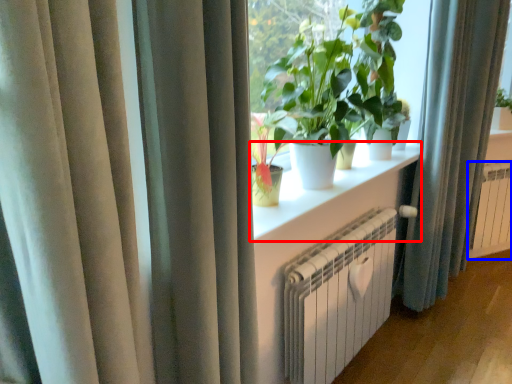
Question: Which object is closer to the camera taking this photo, window sill (highlighted by a red box) or radiator (highlighted by a blue box)?

Choices:
 (A) window sill
 (B) radiator

Answer: (A)